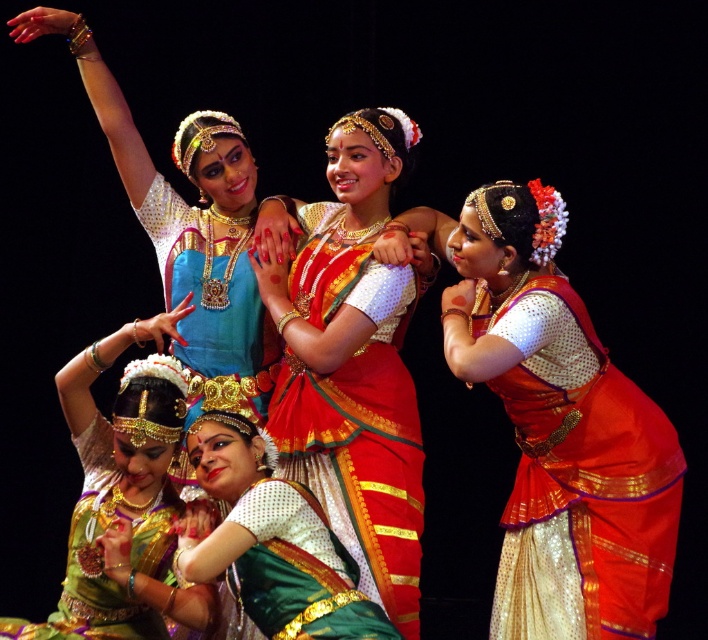
Does silk saree at center have a lesser width compared to green satin saree at center?

No, silk saree at center is not thinner than green satin saree at center.

Is silk saree at center below green satin saree at center?

Incorrect, silk saree at center is not positioned below green satin saree at center.

Between point (331, 243) and point (253, 518), which one is positioned in front?

Point (253, 518) is in front.

Identify the location of silk saree at center. (353, 362).

Is silky green saree at center to the right of green satin saree at center from the viewer's perspective?

In fact, silky green saree at center is to the left of green satin saree at center.

Does silky green saree at center come behind green satin saree at center?

No, silky green saree at center is closer to the viewer.

Image resolution: width=708 pixels, height=640 pixels. I want to click on silky green saree at center, so click(268, 540).

Can you confirm if silk saree at center is bigger than silky green saree at center?

Correct, silk saree at center is larger in size than silky green saree at center.

Is silk saree at center wider than silky green saree at center?

Yes.

Who is more distant from viewer, (348, 518) or (216, 444)?

The point (348, 518) is behind.

Where is `silk saree at center`? silk saree at center is located at coordinates (353, 362).